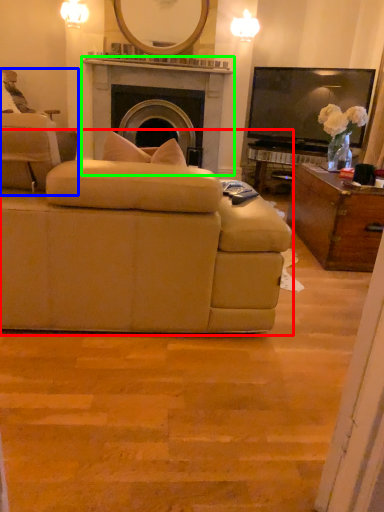
Question: Which object is the closest to the studio couch (highlighted by a red box)? Choose among these: chair (highlighted by a blue box) or fireplace (highlighted by a green box).

Choices:
 (A) chair
 (B) fireplace

Answer: (A)